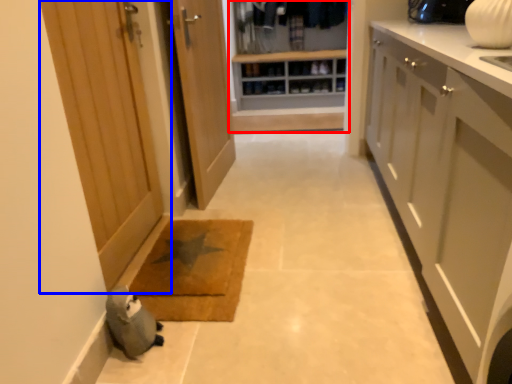
Question: Which object is further to the camera taking this photo, closet (highlighted by a red box) or door (highlighted by a blue box)?

Choices:
 (A) closet
 (B) door

Answer: (A)